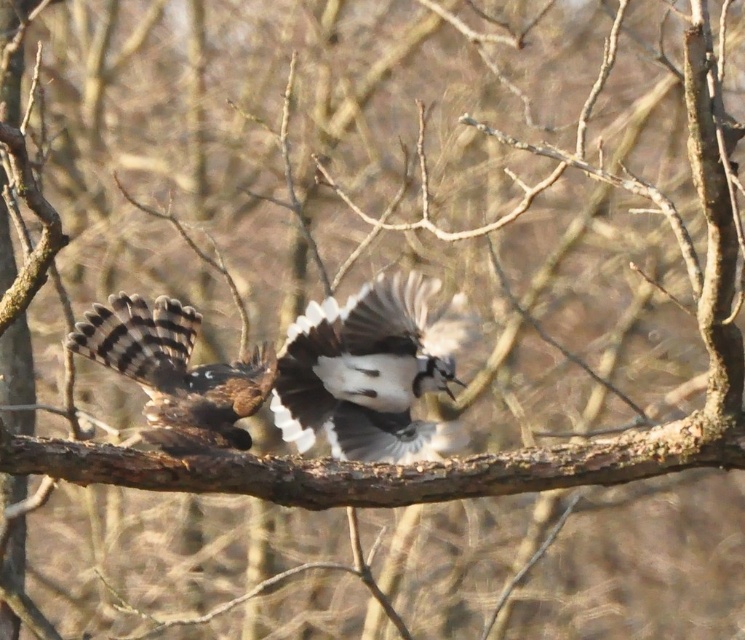
Can you confirm if white glossy bird at center is smaller than brown speckled hawk at left?

Actually, white glossy bird at center might be larger than brown speckled hawk at left.

From the picture: Does white glossy bird at center have a greater height compared to brown speckled hawk at left?

Yes.

Find the location of a particular element. white glossy bird at center is located at coordinates (367, 372).

Locate an element on the screen. This screenshot has width=745, height=640. white glossy bird at center is located at coordinates click(x=367, y=372).